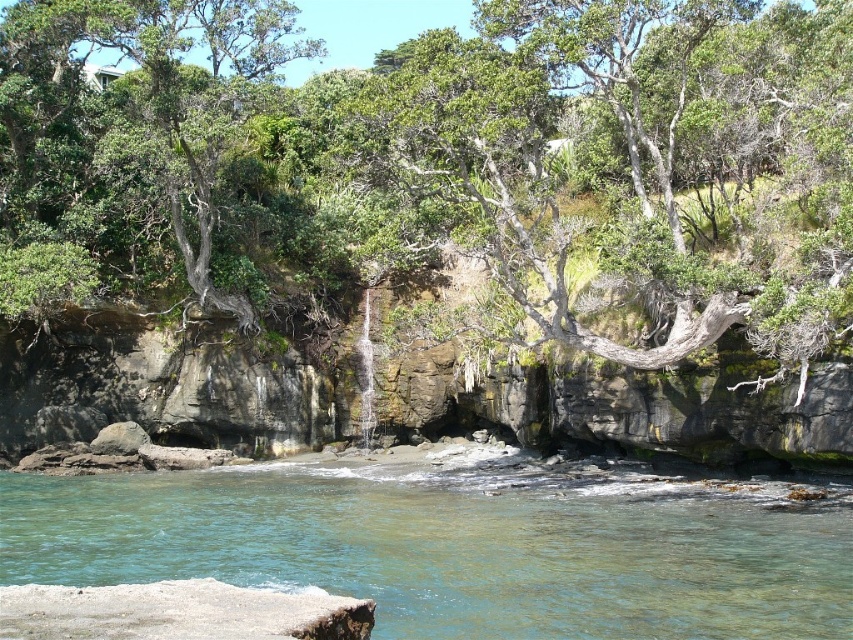
Question: Among these objects, which one is nearest to the camera?

Choices:
 (A) green leafy tree at center
 (B) clear water at lower center

Answer: (B)

Question: Observing the image, what is the correct spatial positioning of green leafy tree at center in reference to clear water at lower center?

Choices:
 (A) right
 (B) left

Answer: (A)

Question: Does green leafy tree at center appear on the left side of clear water at lower center?

Choices:
 (A) yes
 (B) no

Answer: (B)

Question: Is green leafy tree at center below clear water at lower center?

Choices:
 (A) no
 (B) yes

Answer: (A)

Question: Which of the following is the closest to the observer?

Choices:
 (A) [x=132, y=506]
 (B) [x=635, y=65]

Answer: (A)

Question: Which point is farther to the camera?

Choices:
 (A) clear water at lower center
 (B) green leafy tree at center

Answer: (B)